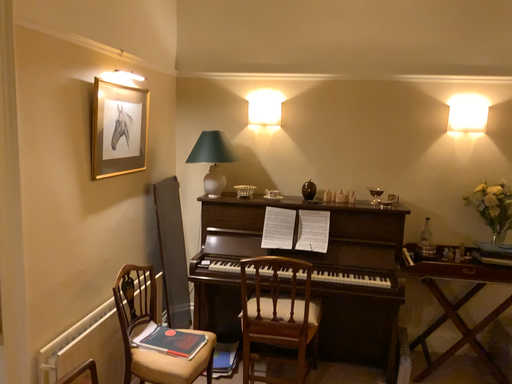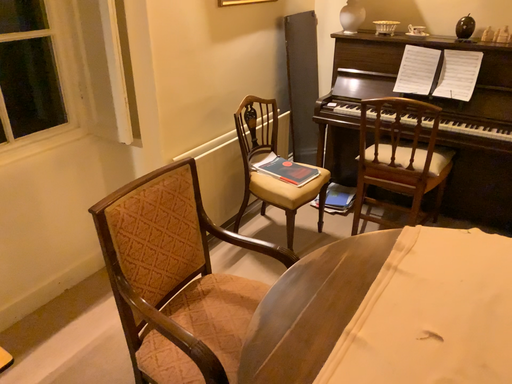
Question: How did the camera likely rotate when shooting the video?

Choices:
 (A) rotated left
 (B) rotated right

Answer: (A)